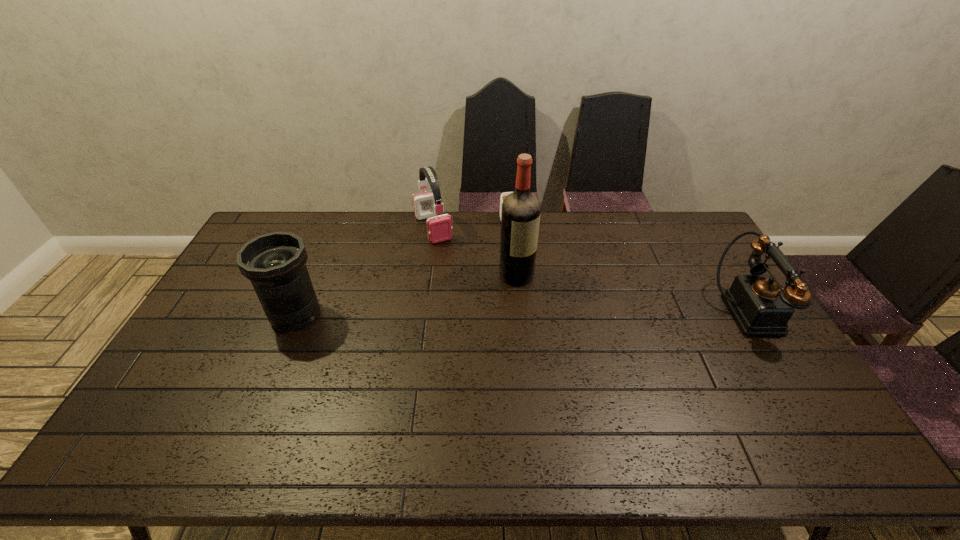
The width and height of the screenshot is (960, 540). Identify the location of vacant area situated 0.060m on the outer surface of the earphone. (445, 254).

This screenshot has width=960, height=540. What are the coordinates of `blank area located 0.060m on the outer surface of the earphone` in the screenshot? It's located at (445, 254).

Identify the location of vacant area situated 0.220m on the side with the handle of the shortest object. (523, 273).

The width and height of the screenshot is (960, 540). Identify the location of free location located on the side with the handle of the shortest object. (522, 272).

Locate an element on the screen. The image size is (960, 540). free space located on the side with the handle of the shortest object is located at coordinates (528, 296).

Find the location of a particular element. The height and width of the screenshot is (540, 960). earphone that is at the far edge is located at coordinates (428, 205).

Find the location of a particular element. cup at the far edge is located at coordinates (503, 195).

You are a GUI agent. You are given a task and a screenshot of the screen. Output one action in this format:
    pyautogui.click(x=<x>, y=<y>)
    Task: Click on the object that is at the right edge
    The width and height of the screenshot is (960, 540).
    Given the screenshot: What is the action you would take?
    pyautogui.click(x=761, y=306)

The width and height of the screenshot is (960, 540). I want to click on free space at the far edge of the desktop, so click(328, 224).

This screenshot has height=540, width=960. Identify the location of vacant space at the near edge of the desktop. (229, 396).